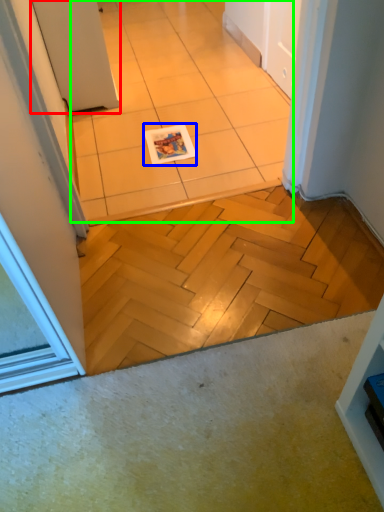
Question: Which object is positioned farthest from door (highlighted by a red box)? Select from magazine (highlighted by a blue box) and ceramic tile (highlighted by a green box).

Choices:
 (A) magazine
 (B) ceramic tile

Answer: (A)